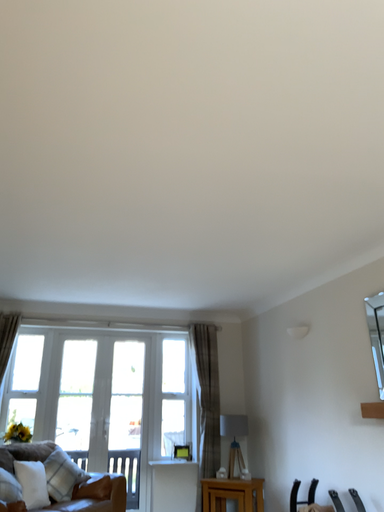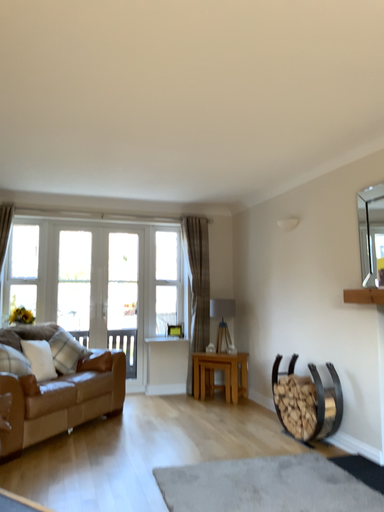
Question: How did the camera likely rotate when shooting the video?

Choices:
 (A) rotated downward
 (B) rotated upward

Answer: (A)